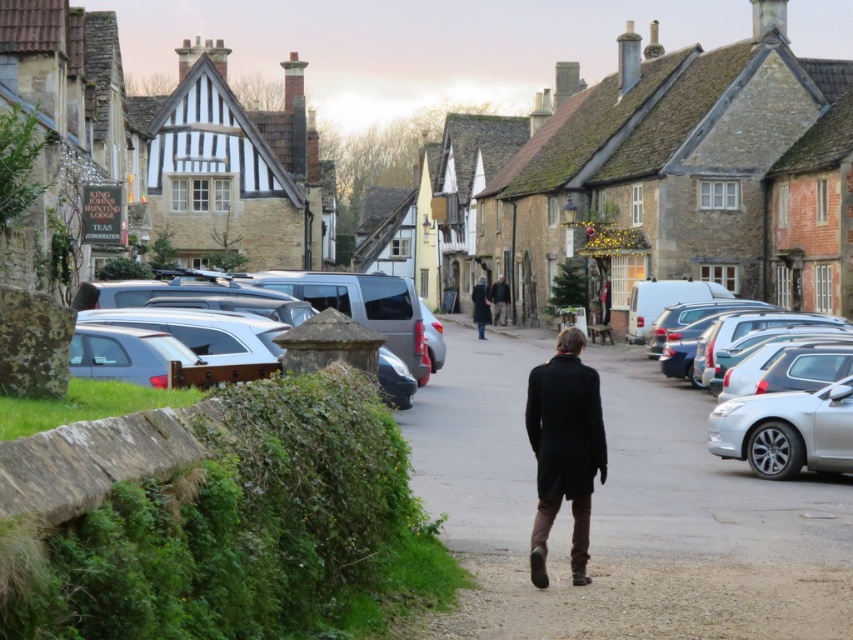
Locate an element on the screen. The image size is (853, 640). stone village at center is located at coordinates (646, 179).

Looking at this image, which is below, stone village at center or dark brown leather coat at center?

dark brown leather coat at center is lower down.

Is point (815, 237) behind point (491, 284)?

No, (815, 237) is closer to viewer.

Locate an element on the screen. stone village at center is located at coordinates (646, 179).

Who is positioned more to the left, stone village at center or silver metallic car at right?

Positioned to the left is stone village at center.

Can you confirm if stone village at center is positioned above silver metallic car at right?

Indeed, stone village at center is positioned over silver metallic car at right.

You are a GUI agent. You are given a task and a screenshot of the screen. Output one action in this format:
    pyautogui.click(x=<x>, y=<y>)
    Task: Click on the stone village at center
    
    Given the screenshot: What is the action you would take?
    (x=646, y=179)

Can you confirm if dark brown coat at center is shorter than dark brown leather coat at center?

Incorrect, dark brown coat at center's height does not fall short of dark brown leather coat at center's.

Is dark brown coat at center positioned at the back of dark brown leather coat at center?

That is False.

Who is more distant from viewer, (485, 317) or (492, 307)?

Positioned behind is point (492, 307).

You are a GUI agent. You are given a task and a screenshot of the screen. Output one action in this format:
    pyautogui.click(x=<x>, y=<y>)
    Task: Click on the dark brown coat at center
    The image size is (853, 640).
    Given the screenshot: What is the action you would take?
    pyautogui.click(x=480, y=307)